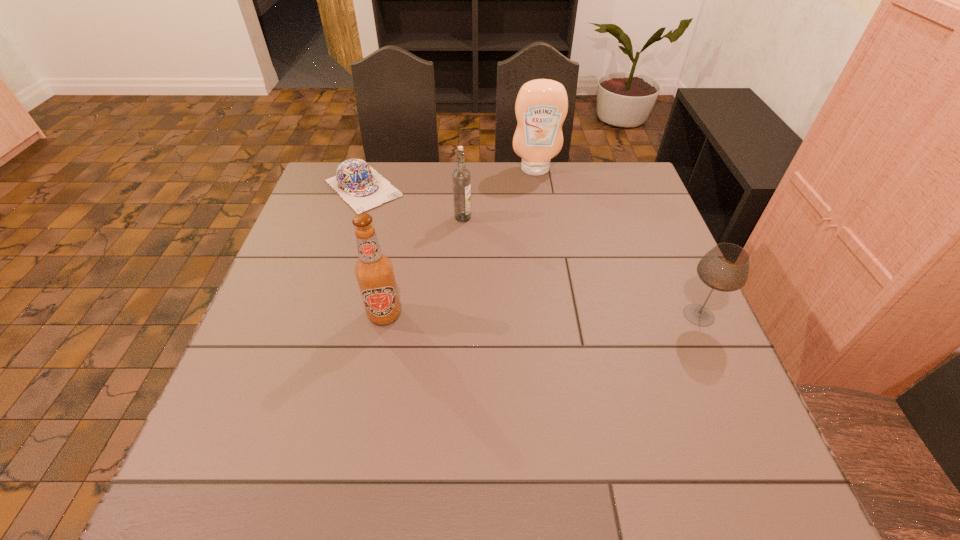
Identify the location of free spot on the desktop that is between the beer bottle and the rightmost object and is positioned on the label of the third tallest object. The image size is (960, 540). (584, 315).

Locate an element on the screen. The height and width of the screenshot is (540, 960). free spot on the desktop that is between the beer bottle and the rightmost object and is positioned on the label of the condiment is located at coordinates (552, 315).

This screenshot has width=960, height=540. I want to click on vacant space on the desktop that is between the beer bottle and the wineglass and is positioned on the front, side, and top of the cap, so click(495, 315).